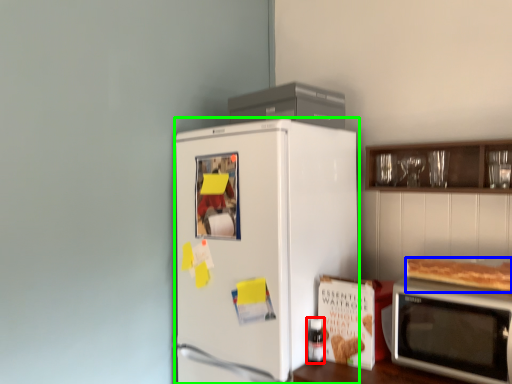
Question: Which object is the farthest from bottle (highlighted by a red box)? Choose among these: food (highlighted by a blue box) or refrigerator (highlighted by a green box).

Choices:
 (A) food
 (B) refrigerator

Answer: (A)